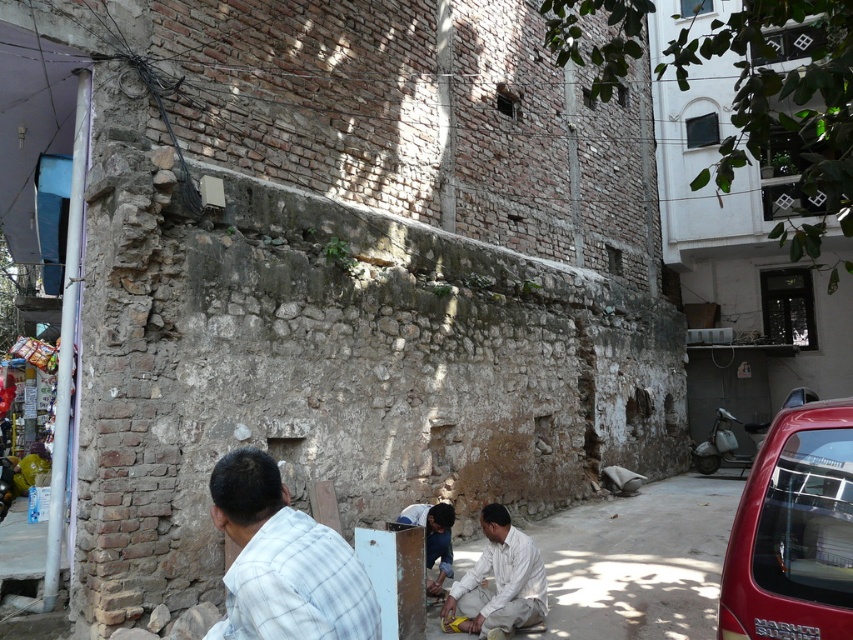
Question: Can you confirm if white checkered shirt at lower left is positioned to the right of light brown fabric shirt at lower center?

Choices:
 (A) yes
 (B) no

Answer: (B)

Question: Does shiny red car at lower right appear on the right side of light brown fabric shirt at lower center?

Choices:
 (A) yes
 (B) no

Answer: (A)

Question: Does shiny red car at lower right appear under light brown fabric shirt at lower center?

Choices:
 (A) yes
 (B) no

Answer: (B)

Question: Considering the real-world distances, which object is farthest from the light brown fabric shirt at lower center?

Choices:
 (A) white checkered shirt at lower left
 (B) shiny red car at lower right

Answer: (A)

Question: Which point is farther to the camera?

Choices:
 (A) (734, 612)
 (B) (486, 612)

Answer: (B)

Question: Which point is closer to the camera?

Choices:
 (A) light brown fabric shirt at lower center
 (B) shiny red car at lower right
 (C) white checkered shirt at lower left

Answer: (C)